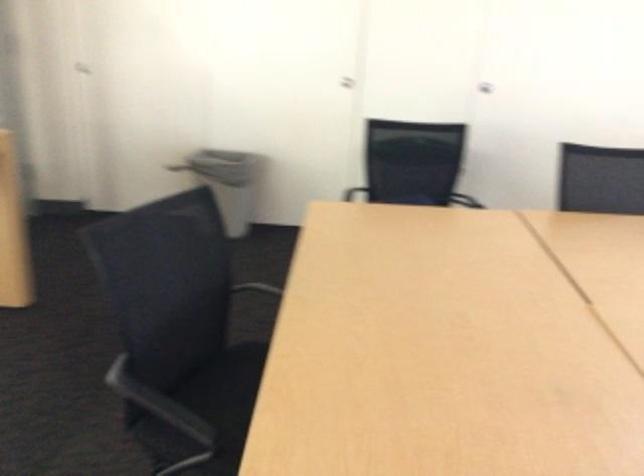
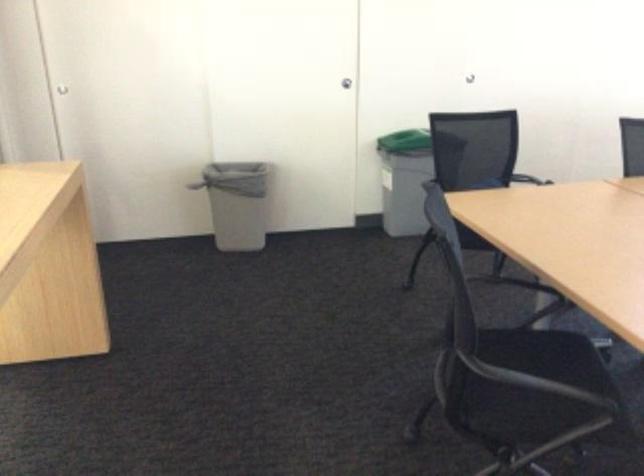
The point at (292, 342) is marked in the first image. Where is the corresponding point in the second image?

(542, 347)